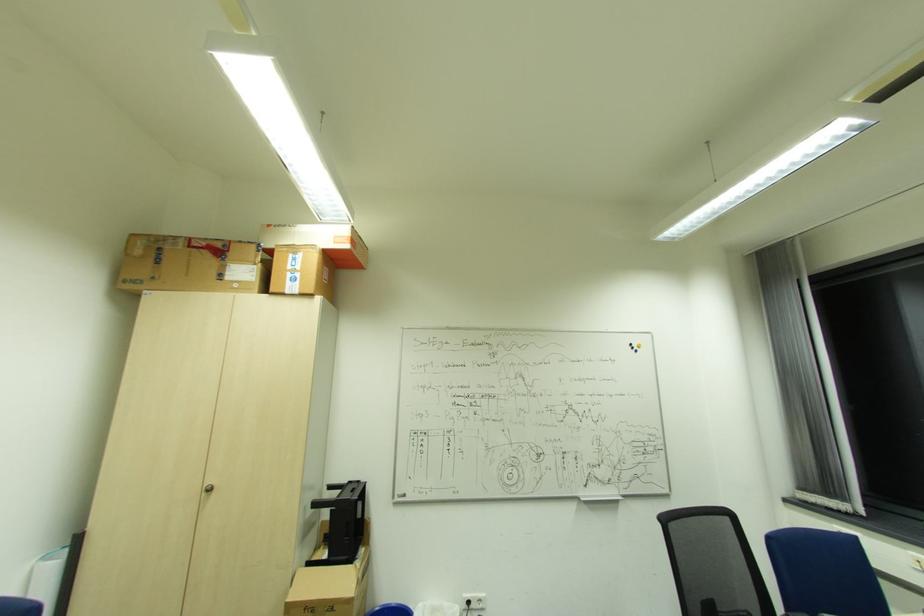
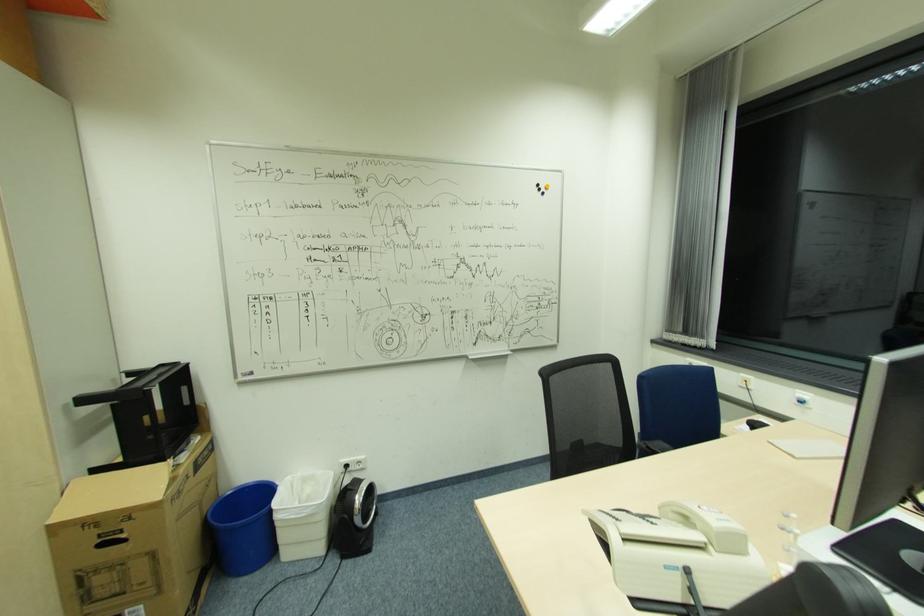
In the second image, find the point that corresponds to point (633, 344) in the first image.

(541, 185)